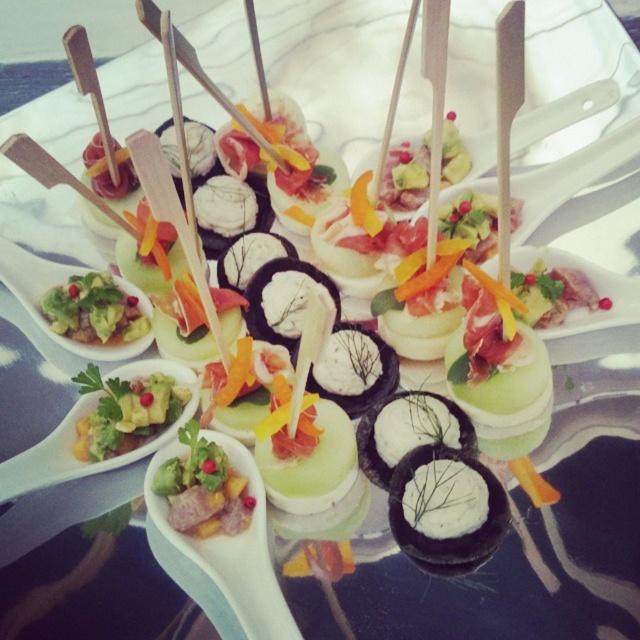
You are a food critic standing in front of the appetizer display. You want to describe the location of the green leafy salad at center to your colleague. Where exactly is it located?

The green leafy salad at center is located at point (x=202, y=488).

You are a food stylist arranging appetizers on a reflective surface. You have two green items at the center of the arrangement, the green leafy salad at center and the green avocado spread at center. Which of these two items has a greater thickness in the image?

The green avocado spread at center is thicker than the green leafy salad at center, so the avocado spread has a greater thickness.